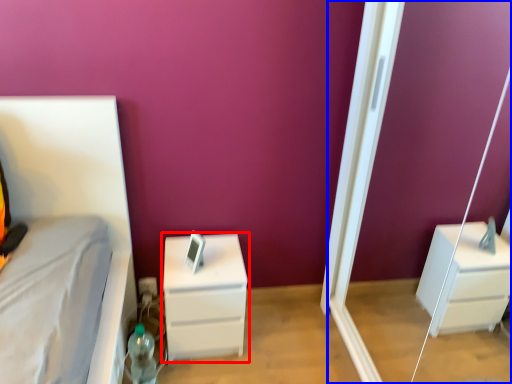
Question: Among these objects, which one is nearest to the camera, chest of drawers (highlighted by a red box) or screen door (highlighted by a blue box)?

Choices:
 (A) chest of drawers
 (B) screen door

Answer: (B)